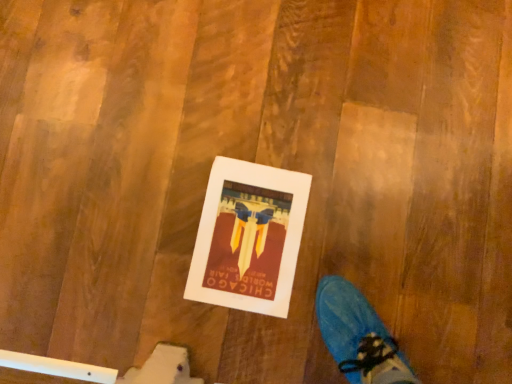
The image size is (512, 384). Find the location of `empty space that is ontop of matte paper postcard at center (from a real-world perspective)`. empty space that is ontop of matte paper postcard at center (from a real-world perspective) is located at coordinates (251, 238).